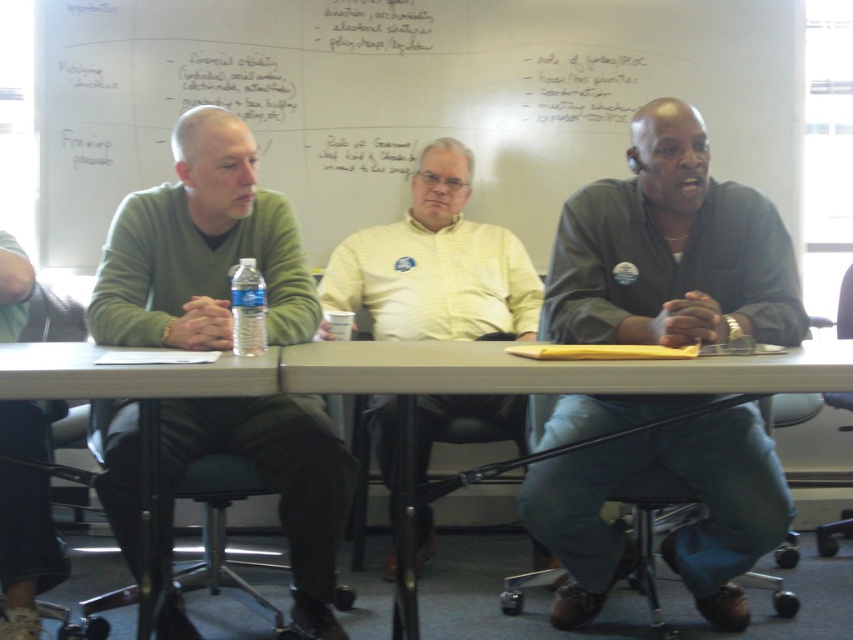
I want to click on whiteboard at upper center, so click(x=404, y=99).

Does whiteboard at upper center have a greater height compared to green sweater at left?

In fact, whiteboard at upper center may be shorter than green sweater at left.

Find the location of a particular element. The image size is (853, 640). whiteboard at upper center is located at coordinates (404, 99).

Find the location of a particular element. This screenshot has height=640, width=853. whiteboard at upper center is located at coordinates (404, 99).

I want to click on yellow shirt at center, so click(x=436, y=264).

Who is more forward, (x=416, y=512) or (x=235, y=352)?

Point (x=235, y=352) is more forward.

The image size is (853, 640). What are the coordinates of `yellow shirt at center` in the screenshot? It's located at (436, 264).

Identify the location of yellow shirt at center. (436, 264).

Image resolution: width=853 pixels, height=640 pixels. Identify the location of dark gray shirt at center. (670, 250).

Is point (715, 570) positioned after point (480, 278)?

No.

I want to click on dark gray shirt at center, so pos(670,250).